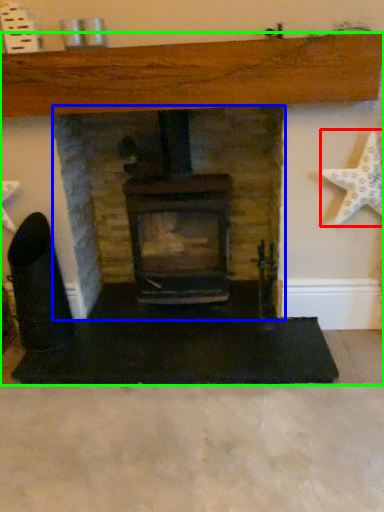
Question: Which object is the farthest from starfish (highlighted by a red box)? Choose among these: fireplace (highlighted by a blue box) or fireplace (highlighted by a green box).

Choices:
 (A) fireplace
 (B) fireplace

Answer: (A)